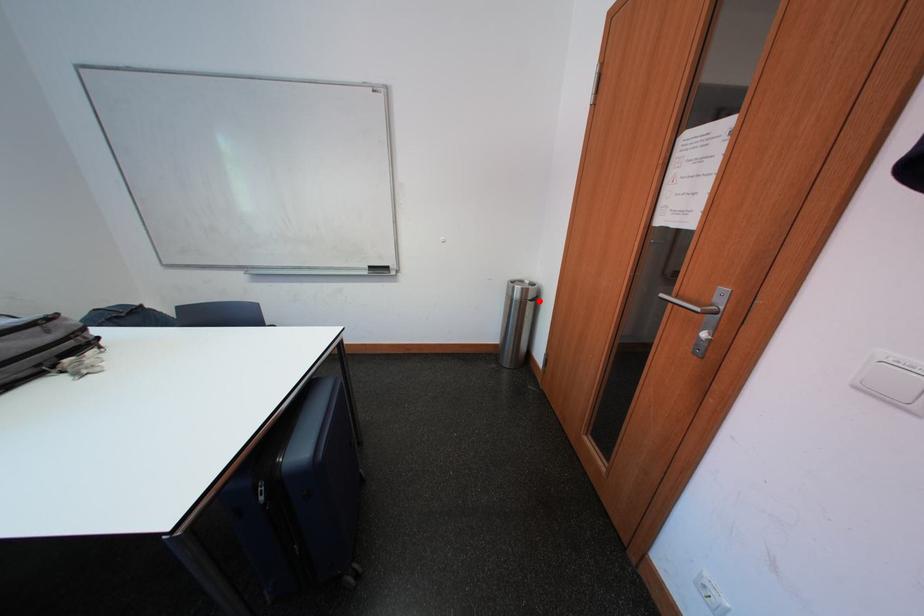
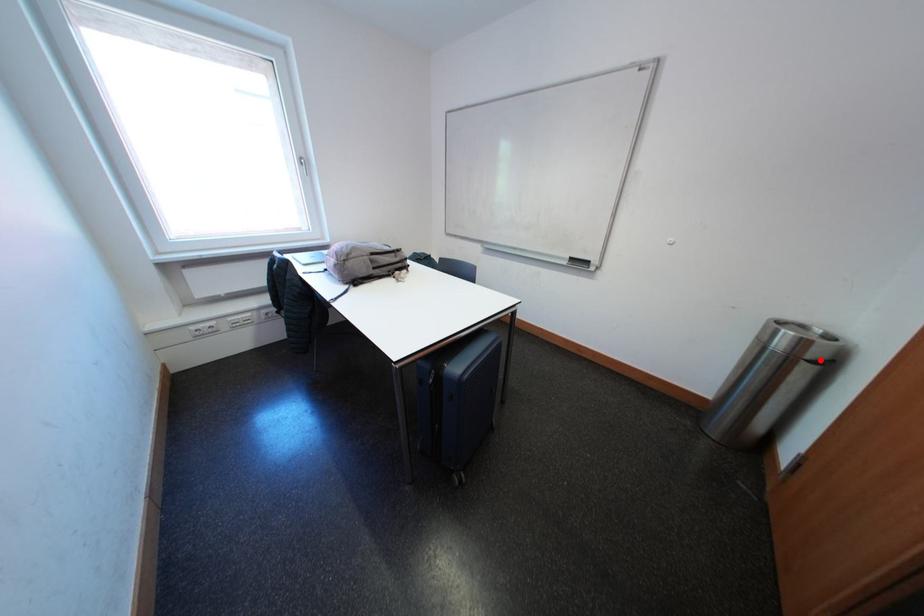
I am providing you with two images of the same scene from different viewpoints. A red point is marked on the first image and another point is marked on the second image. Are the points marked in image1 and image2 representing the same 3D position?

Yes